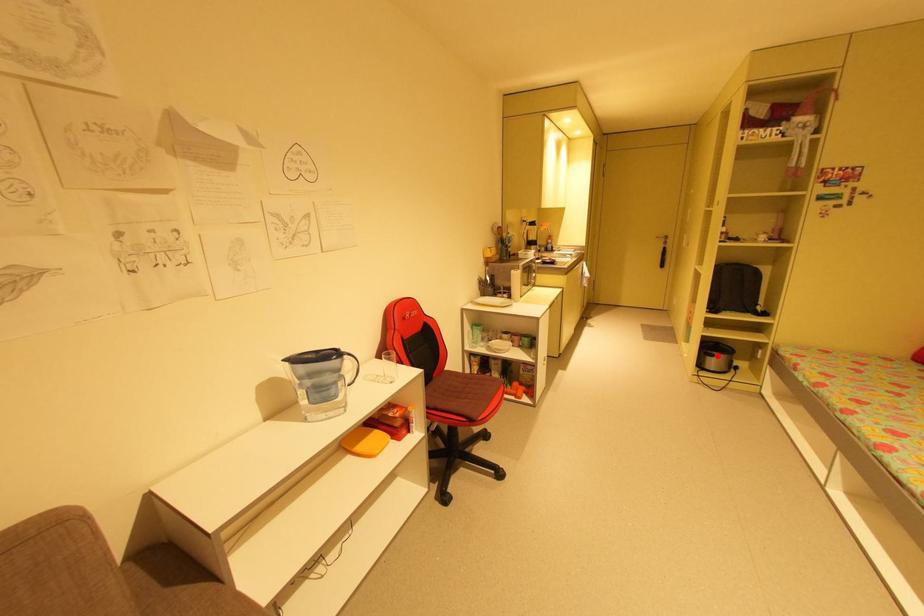
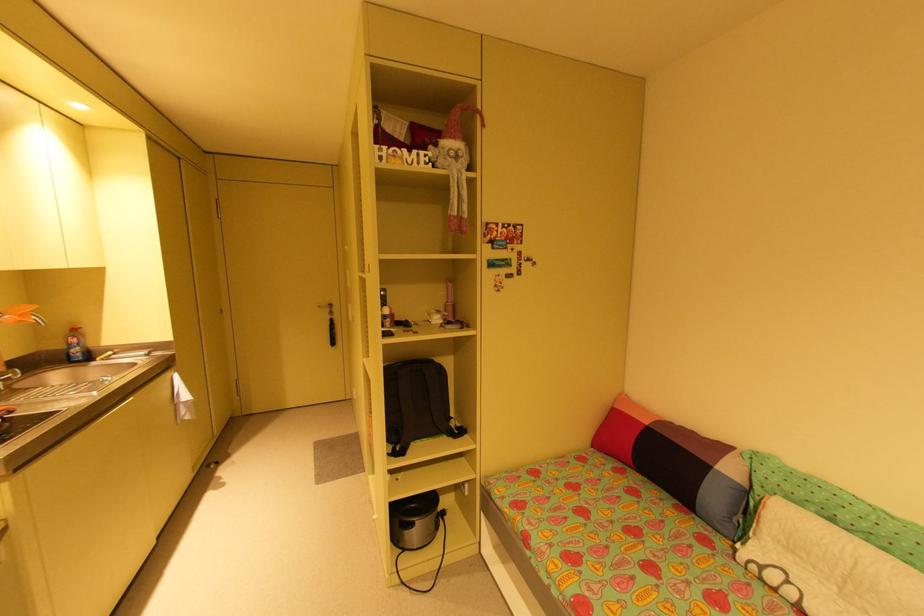
The point at the highlighted location is marked in the first image. Where is the corresponding point in the second image?

(417, 525)